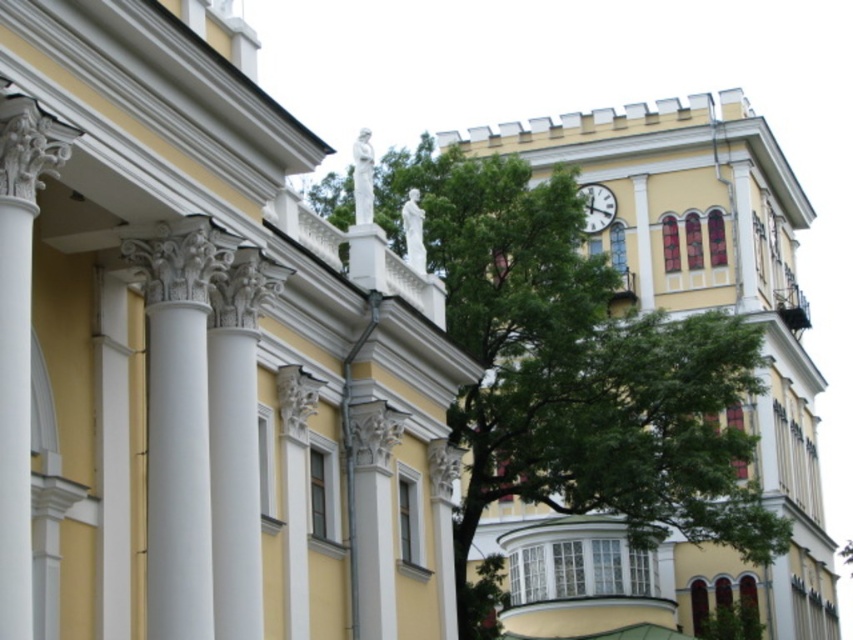
Can you confirm if white marble columns at upper left is positioned above green leafy tree at upper center?

No.

Does point (105, 180) come farther from viewer compared to point (474, 618)?

No, (105, 180) is closer to viewer.

What are the coordinates of `white marble columns at upper left` in the screenshot? It's located at (x=201, y=353).

Is white marble column at left behind white glossy clock at upper center?

That is False.

How distant is white marble column at left from white glossy clock at upper center?

white marble column at left and white glossy clock at upper center are 88.81 meters apart from each other.

Is point (22, 634) positioned before point (604, 212)?

Yes.

Locate an element on the screen. white marble column at left is located at coordinates (19, 337).

Can you confirm if white marble columns at upper left is wider than white glossy clock at upper center?

Indeed, white marble columns at upper left has a greater width compared to white glossy clock at upper center.

Between white marble columns at upper left and white glossy clock at upper center, which one is positioned lower?

white marble columns at upper left is lower down.

Does point (181, 177) come closer to viewer compared to point (599, 205)?

Yes, it is.

Identify the location of white marble columns at upper left. (201, 353).